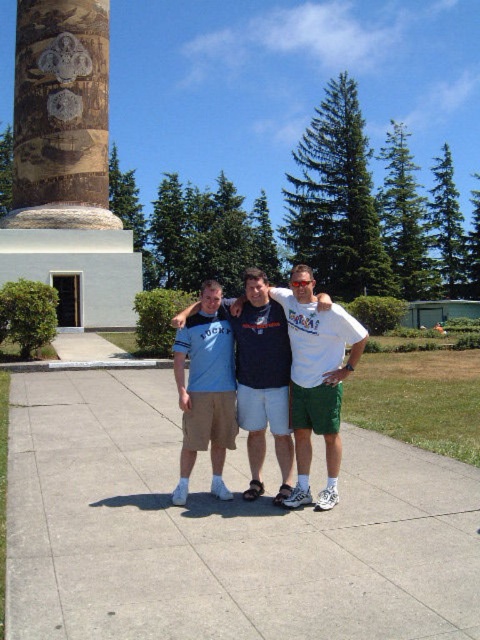
Question: Is concrete at center below brown textured column at upper left?

Choices:
 (A) no
 (B) yes

Answer: (B)

Question: Can you confirm if concrete at center is positioned to the left of dark blue t-shirt at center?

Choices:
 (A) no
 (B) yes

Answer: (B)

Question: Based on their relative distances, which object is nearer to the dark blue t-shirt at center?

Choices:
 (A) matte blue t-shirt at center
 (B) blue cotton shirt at center
 (C) brown textured column at upper left
 (D) concrete at center

Answer: (A)

Question: Based on their relative distances, which object is farther from the brown textured column at upper left?

Choices:
 (A) dark blue t-shirt at center
 (B) blue cotton shirt at center

Answer: (A)

Question: Which point is closer to the camera?

Choices:
 (A) (277, 321)
 (B) (188, 428)
 (C) (278, 294)

Answer: (B)

Question: Is brown textured column at upper left to the right of matte blue t-shirt at center from the viewer's perspective?

Choices:
 (A) no
 (B) yes

Answer: (A)